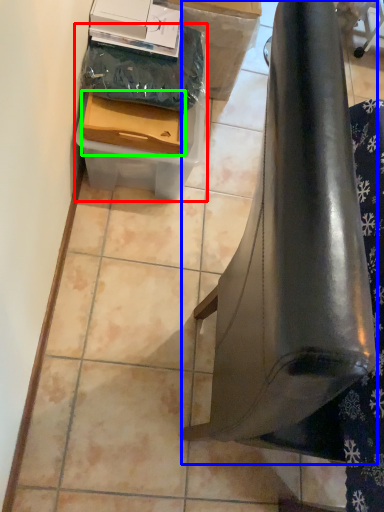
Question: Estimate the real-world distances between objects in this image. Which object is farther from box (highlighted by a red box), furniture (highlighted by a blue box) or box (highlighted by a green box)?

Choices:
 (A) furniture
 (B) box

Answer: (A)